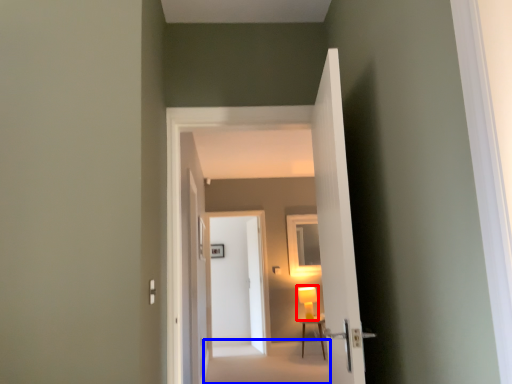
Question: Which of the following is the closest to the observer, table lamp (highlighted by a red box) or path (highlighted by a blue box)?

Choices:
 (A) table lamp
 (B) path

Answer: (B)